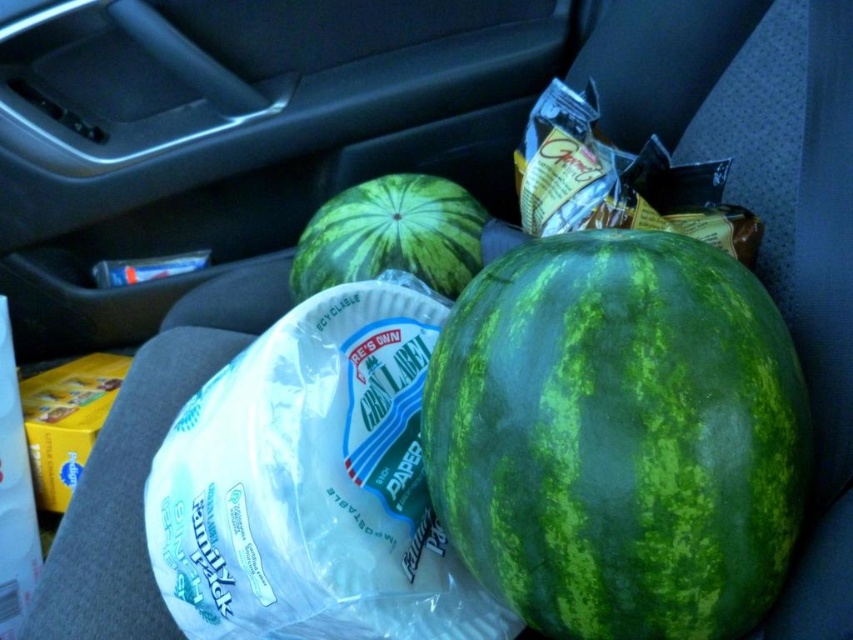
You are a delivery person who needs to place a package on the passenger seat of the car. The package is 1 meter long. Can you place it between the green textured melon at center and the edge of the seat? Please explain your reasoning based on the spatial information provided.

The green textured melon at center is located at point (619,436). Without knowing the exact dimensions of the seat or the distance between the melon and the edge, it is impossible to determine if the 1 meter long package can fit. More information about the seat dimensions or the distance from the melon to the edge is required to make an accurate assessment.

You are a delivery person who needs to place a large box on the passenger seat of the car. The box is 1.2 meters long. Considering the space occupied by the green textured melon at center and the green textured watermelon at center, will there be enough space to fit the box horizontally?

The green textured melon at center is larger than the green textured watermelon at center. However, the combined space they occupy might still leave enough room for the 1.2 meter box. Since both watermelons are at the center, moving them aside could create space. Alternatively, if they remain, the box may not fit due to their central placement. It depends on rearrangement.